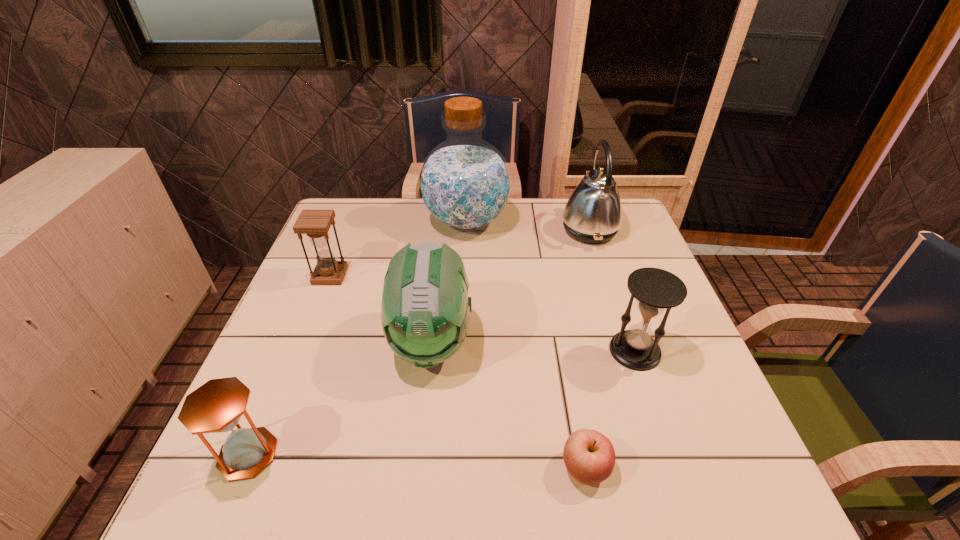
At what (x,y) coordinates should I click in order to perform the action: click on vacant region between the second nearest hourglass and the fifth object from left to right. Please return your answer as a coordinate pair (x, y). Looking at the image, I should click on (611, 409).

Where is `free spot between the nearest hourglass and the fifth nearest object`? The image size is (960, 540). free spot between the nearest hourglass and the fifth nearest object is located at coordinates (289, 365).

Choose which object is the nearest neighbor to the kettle. Please provide its 2D coordinates. Your answer should be formatted as a tuple, i.e. [(x, y)], where the tuple contains the x and y coordinates of a point satisfying the conditions above.

[(464, 183)]

Identify the location of object that stands as the third closest to the nearest hourglass. (589, 456).

Select which hourglass is the closest to the tallest object. Please provide its 2D coordinates. Your answer should be formatted as a tuple, i.e. [(x, y)], where the tuple contains the x and y coordinates of a point satisfying the conditions above.

[(315, 224)]

The width and height of the screenshot is (960, 540). I want to click on hourglass that is the second closest to the third tallest object, so click(215, 407).

Image resolution: width=960 pixels, height=540 pixels. What are the coordinates of `free space that satisfies the following two spatial constraints: 1. from the spout of the kettle; 2. on the visor of the fifth shortest object` in the screenshot? It's located at (626, 342).

Locate an element on the screen. The height and width of the screenshot is (540, 960). free point that satisfies the following two spatial constraints: 1. on the back side of the tallest object; 2. on the right side of the nearest hourglass is located at coordinates (345, 221).

Where is `vacant region that satisfies the following two spatial constraints: 1. on the visor of the second nearest hourglass; 2. on the right side of the football helmet`? The image size is (960, 540). vacant region that satisfies the following two spatial constraints: 1. on the visor of the second nearest hourglass; 2. on the right side of the football helmet is located at coordinates (430, 351).

Locate an element on the screen. vacant area in the image that satisfies the following two spatial constraints: 1. from the spout of the kettle; 2. on the back side of the rightmost hourglass is located at coordinates (629, 351).